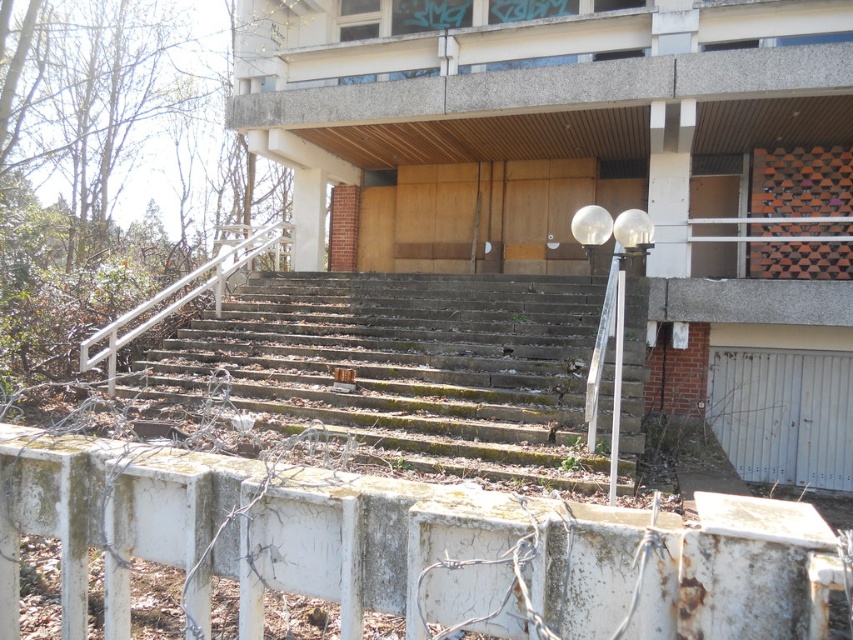
Question: Can you confirm if rusty concrete stairs at center is positioned to the left of white metal railing at left?

Choices:
 (A) yes
 (B) no

Answer: (B)

Question: Which point appears farthest from the camera in this image?

Choices:
 (A) [x=148, y=317]
 (B) [x=538, y=468]

Answer: (A)

Question: Which object is farther from the camera taking this photo?

Choices:
 (A) rusty concrete stairs at center
 (B) white metal railing at left

Answer: (B)

Question: Among these objects, which one is nearest to the camera?

Choices:
 (A) rusty concrete stairs at center
 (B) white metal railing at left

Answer: (A)

Question: Is rusty concrete stairs at center closer to the viewer compared to white metal railing at left?

Choices:
 (A) yes
 (B) no

Answer: (A)

Question: Does rusty concrete stairs at center have a lesser width compared to white metal railing at left?

Choices:
 (A) yes
 (B) no

Answer: (B)